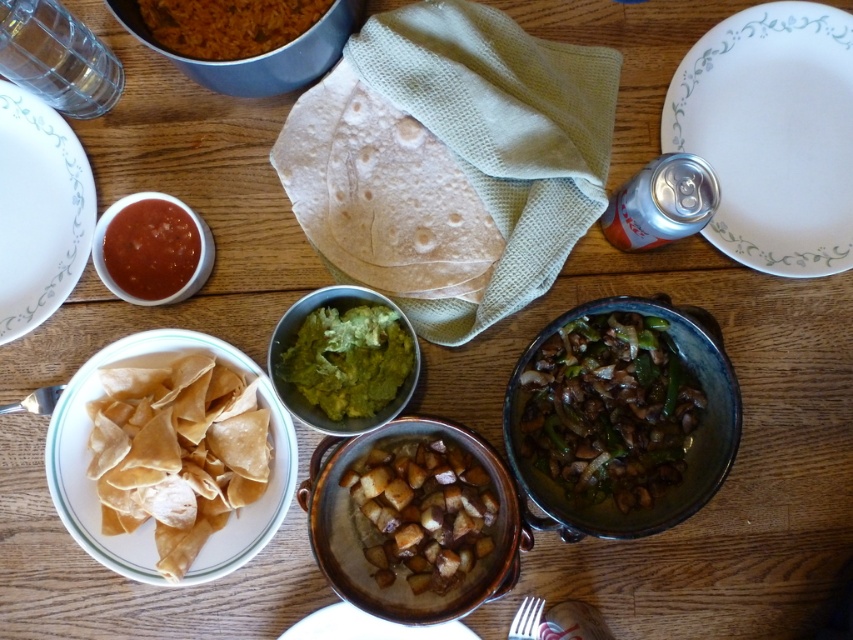
Question: Does white ceramic plate at upper right appear on the left side of brown matte potatoes at center?

Choices:
 (A) yes
 (B) no

Answer: (B)

Question: Does white ceramic plate at upper left have a larger size compared to white ceramic plate at center?

Choices:
 (A) yes
 (B) no

Answer: (A)

Question: Among these points, which one is farthest from the camera?

Choices:
 (A) (428, 540)
 (B) (784, 35)

Answer: (B)

Question: In this image, where is green creamy guacamole at center located relative to matte glass bowl at upper left?

Choices:
 (A) left
 (B) right

Answer: (B)

Question: Which object is the farthest from the brown crispy tortilla chips at lower left?

Choices:
 (A) white ceramic plate at upper right
 (B) white ceramic plate at center
 (C) brown matte potatoes at center
 (D) white ceramic plate at upper left

Answer: (A)

Question: Which of these objects is positioned farthest from the brown matte potatoes at center?

Choices:
 (A) green creamy guacamole at center
 (B) brown matte rice bowl at upper left
 (C) brown crispy tortilla chips at lower left
 (D) white ceramic plate at upper left

Answer: (D)